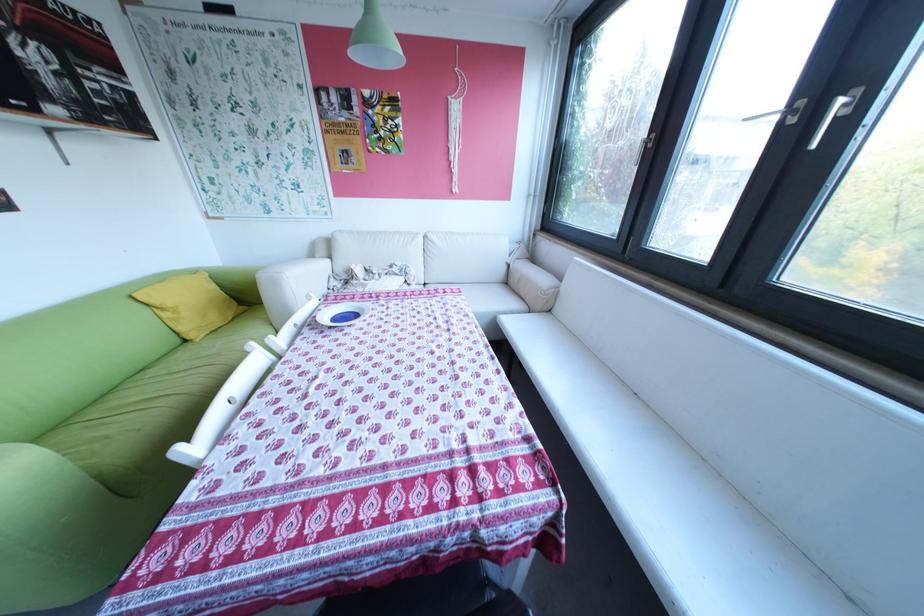
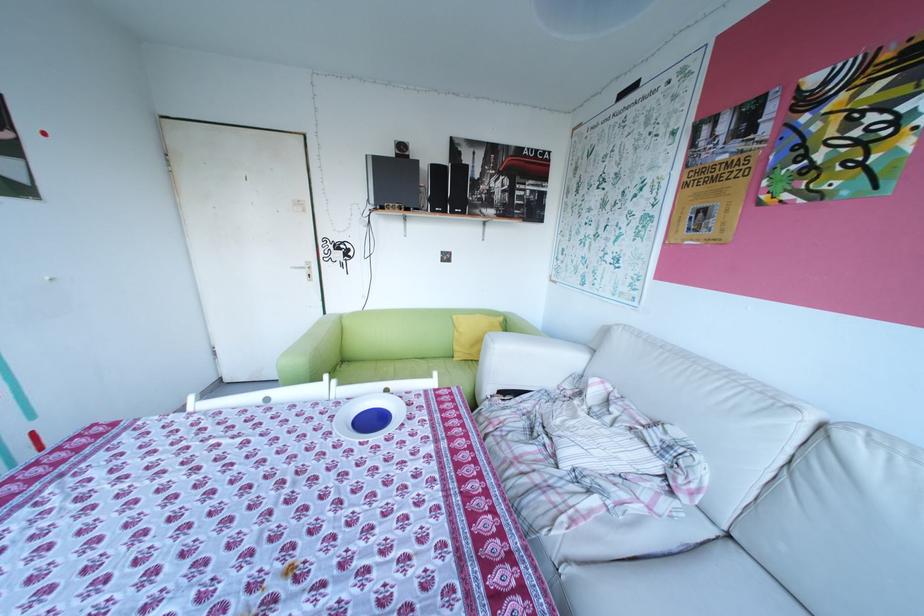
Locate, in the second image, the point that corresponds to (323,294) in the first image.

(448, 374)